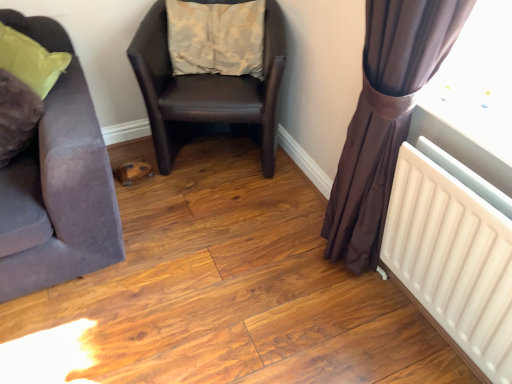
Where is `vacant location below brown sheer curtain at right (from a real-world perspective)`? vacant location below brown sheer curtain at right (from a real-world perspective) is located at coordinates (354, 287).